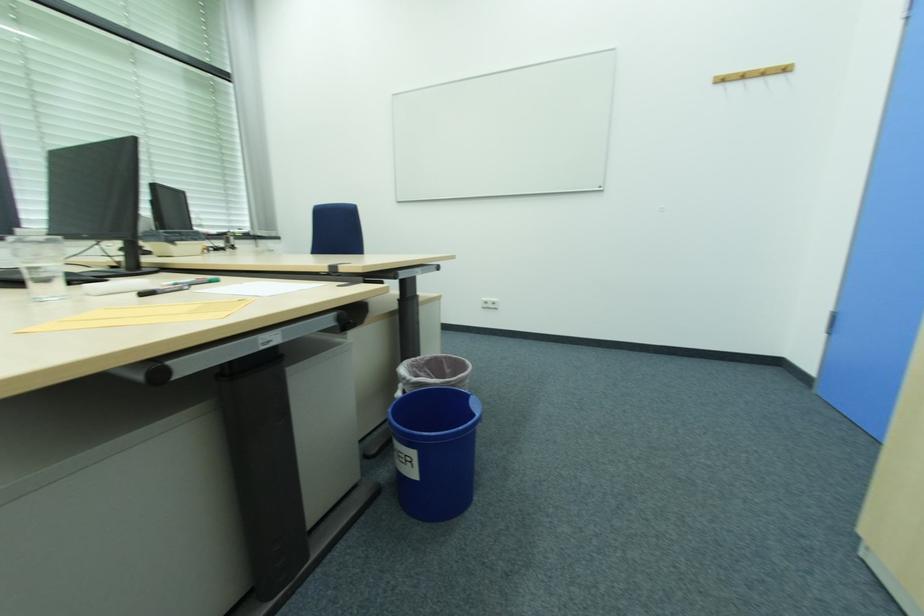
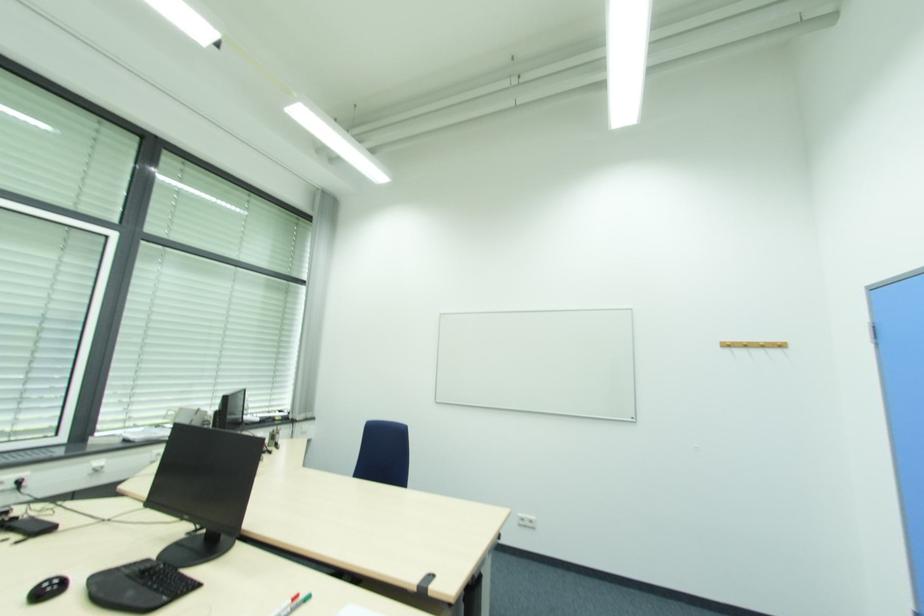
Where in the second image is the point corresponding to the point at 745,76 from the first image?

(748, 346)